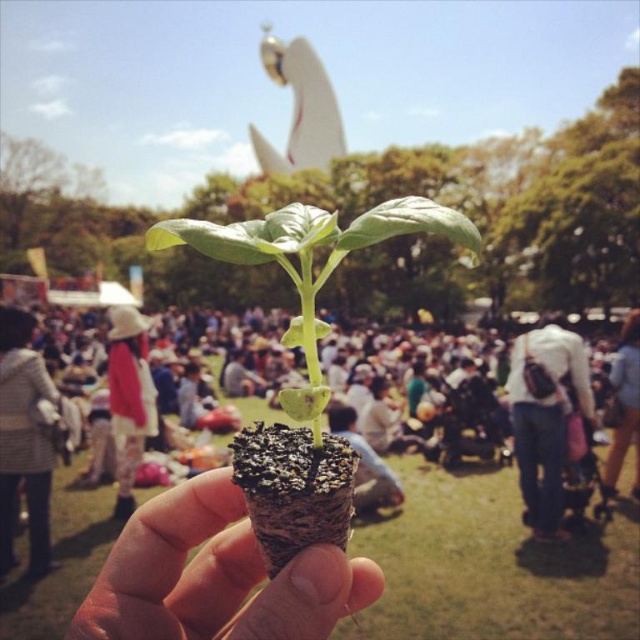
Question: Is denim jacket at center smaller than light brown fabric pants at center?

Choices:
 (A) yes
 (B) no

Answer: (B)

Question: Considering the relative positions of denim jacket at center and light brown fabric pants at center in the image provided, where is denim jacket at center located with respect to light brown fabric pants at center?

Choices:
 (A) below
 (B) above

Answer: (B)

Question: Does dark soil cone at center have a larger size compared to light brown fabric pants at center?

Choices:
 (A) no
 (B) yes

Answer: (A)

Question: Which object appears farthest from the camera in this image?

Choices:
 (A) white cotton hat at center
 (B) light brown fabric pants at center
 (C) denim shorts at lower right

Answer: (C)

Question: Which object is the closest to the brown textured cone at center?

Choices:
 (A) denim jacket at center
 (B) dark soil cone at center
 (C) striped sweater at lower left

Answer: (B)

Question: Which object appears closest to the camera in this image?

Choices:
 (A) white cotton hat at center
 (B) striped sweater at lower left
 (C) brown textured cone at center
 (D) denim shorts at lower right

Answer: (C)